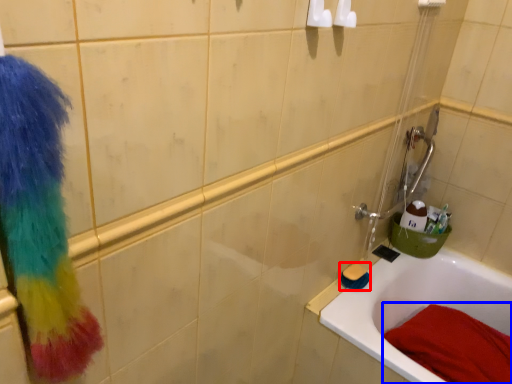
Question: Which of the following is the closest to the observer, brush (highlighted by a red box) or bath towel (highlighted by a blue box)?

Choices:
 (A) brush
 (B) bath towel

Answer: (B)